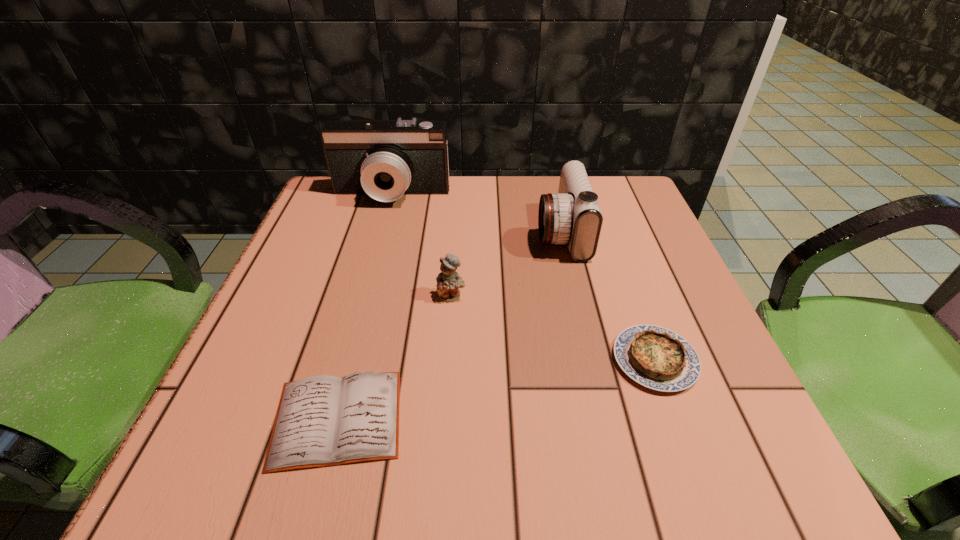
You are a GUI agent. You are given a task and a screenshot of the screen. Output one action in this format:
    pyautogui.click(x=<x>, y=<y>)
    Task: Click on the vacant area between the second shortest object and the diary
    Image resolution: width=960 pixels, height=540 pixels.
    Given the screenshot: What is the action you would take?
    pyautogui.click(x=496, y=389)

The width and height of the screenshot is (960, 540). Find the location of `vacant space in between the third farthest object and the shortest object`. vacant space in between the third farthest object and the shortest object is located at coordinates (395, 357).

Image resolution: width=960 pixels, height=540 pixels. Identify the location of free space between the diary and the tallest object. (365, 307).

Identify the location of free point between the shorter camcorder and the third nearest object. This screenshot has height=540, width=960. (506, 264).

Image resolution: width=960 pixels, height=540 pixels. Identify the location of empty space between the third shortest object and the quiche. (553, 328).

Where is `vacant space that is in between the second tallest object and the left camcorder`? vacant space that is in between the second tallest object and the left camcorder is located at coordinates (476, 214).

Find the location of a particular element. The height and width of the screenshot is (540, 960). vacant area between the third farthest object and the quiche is located at coordinates [x=553, y=328].

The width and height of the screenshot is (960, 540). I want to click on unoccupied area between the third shortest object and the tallest object, so click(x=421, y=245).

At what (x,y) coordinates should I click in order to perform the action: click on vacant area that lies between the shortest object and the taller camcorder. Please return your answer as a coordinate pair (x, y). Looking at the image, I should click on (365, 307).

The width and height of the screenshot is (960, 540). Find the location of `free area in between the third shortest object and the quiche`. free area in between the third shortest object and the quiche is located at coordinates (553, 328).